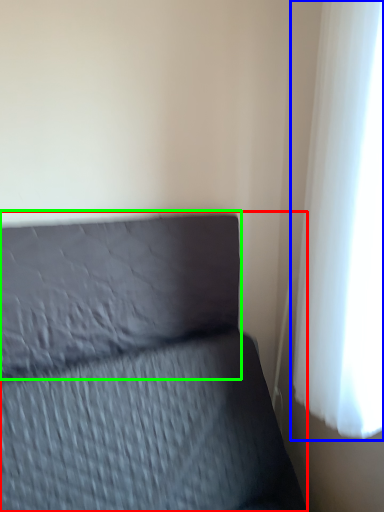
Question: Which object is the closest to the furniture (highlighted by a red box)? Choose among these: curtain (highlighted by a blue box) or pillow (highlighted by a green box).

Choices:
 (A) curtain
 (B) pillow

Answer: (B)